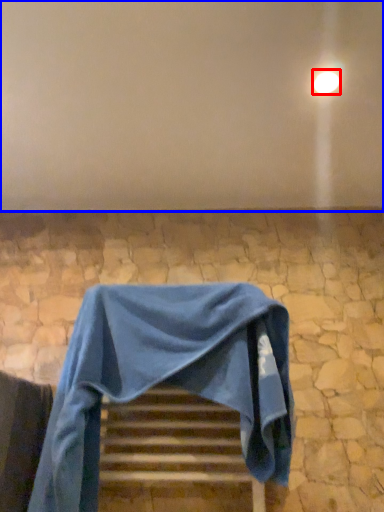
Question: Among these objects, which one is nearest to the camera, light (highlighted by a red box) or backdrop (highlighted by a blue box)?

Choices:
 (A) light
 (B) backdrop

Answer: (B)